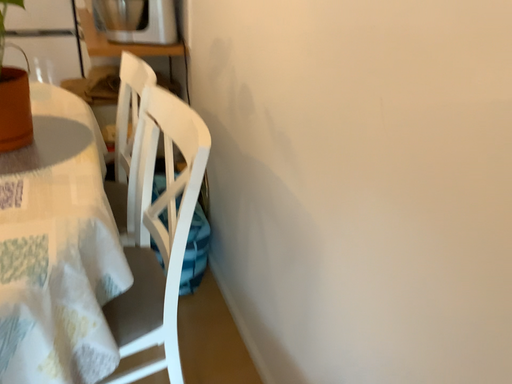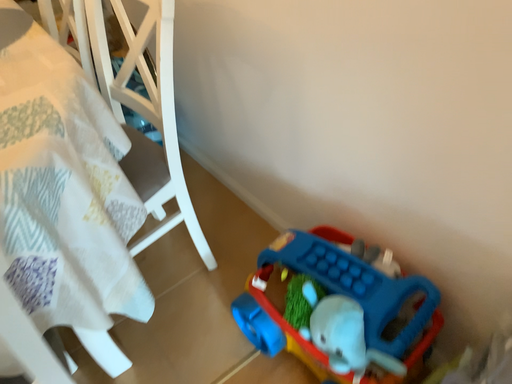
Question: How did the camera likely rotate when shooting the video?

Choices:
 (A) rotated left
 (B) rotated right

Answer: (B)